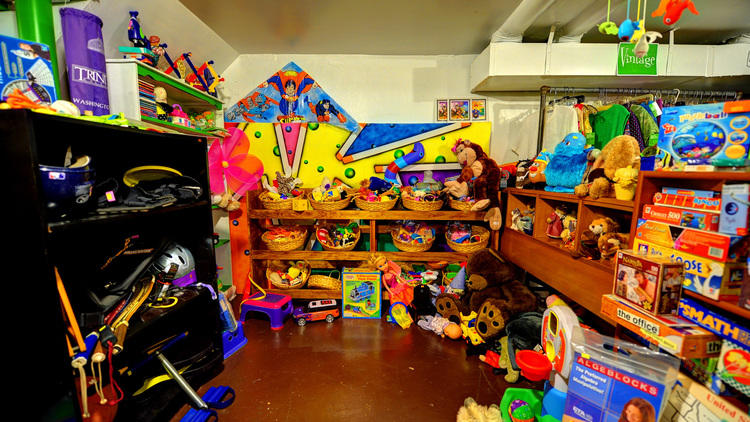
Identify the location of yellow wall. (320, 144).